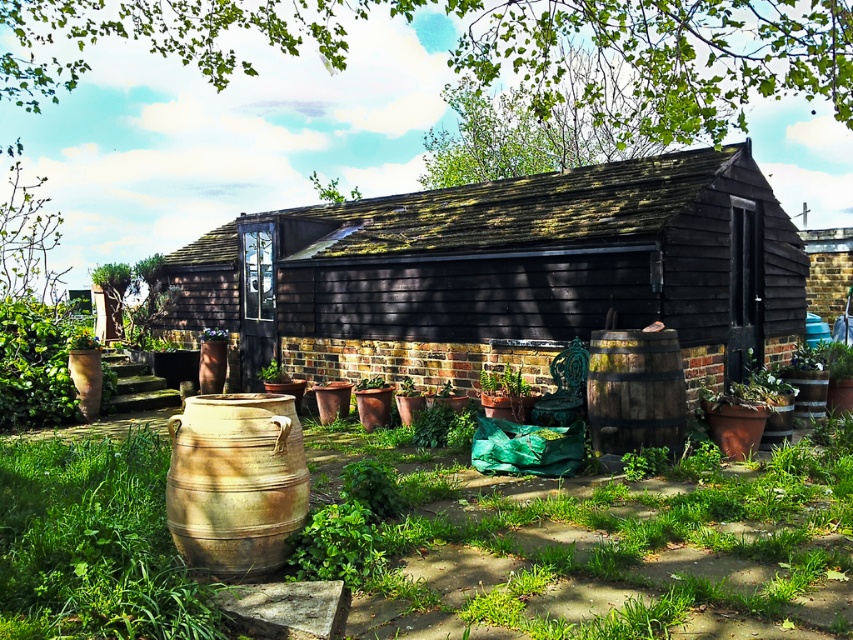
You are standing at the origin point in the image. Where is the black wooden hut at center located in terms of coordinates?

The black wooden hut at center is located at coordinates point (503, 273).

You are standing in front of the shed and want to know how far the point at coordinates (x=390, y=360) is from your current position. Can you determine the distance?

The point at coordinates (x=390, y=360) is 8.60 meters away from your current position.